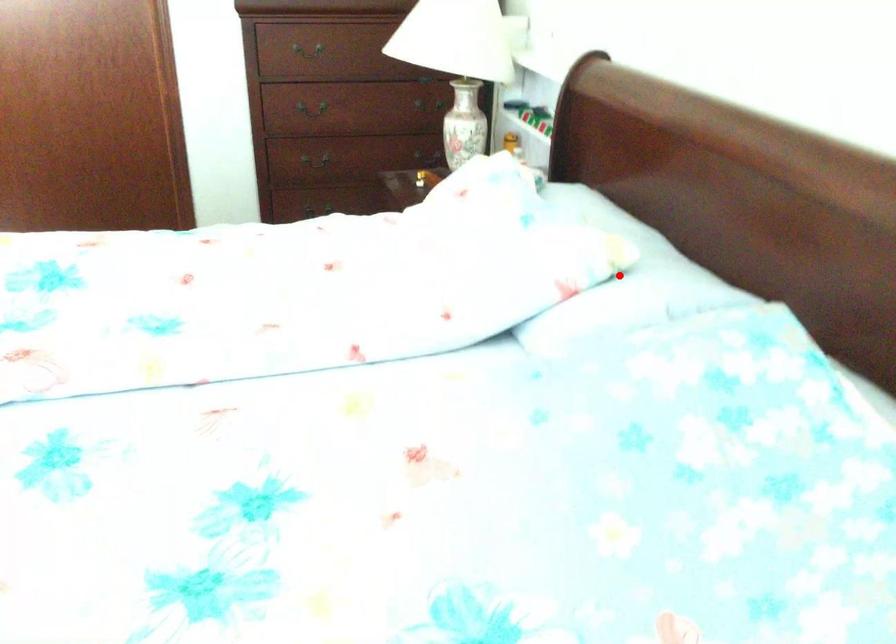
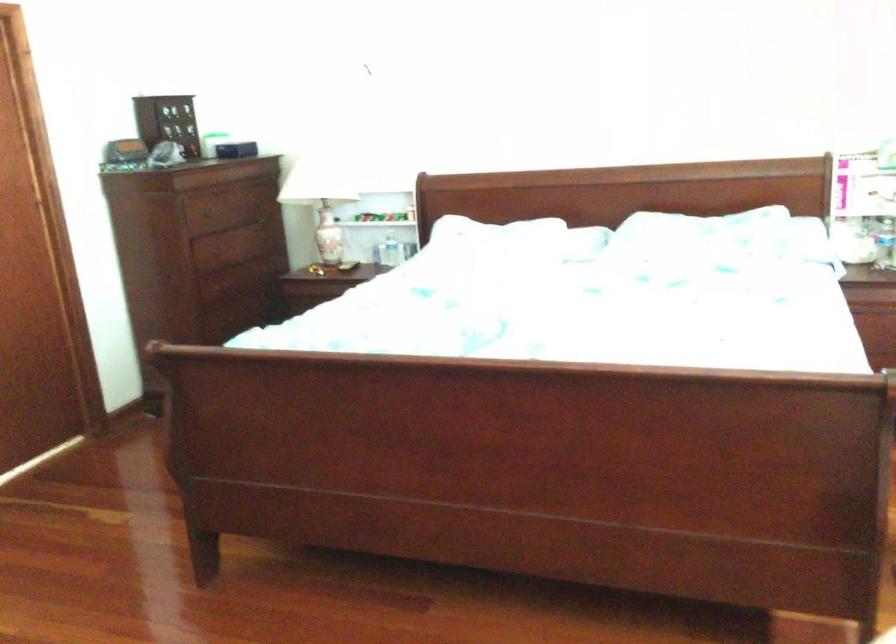
Question: I am providing you with two images of the same scene from different viewpoints. A red point is marked on the first image. At the location where the point appears in image 1, is it still visible in image 2?

Choices:
 (A) Yes
 (B) No

Answer: (B)